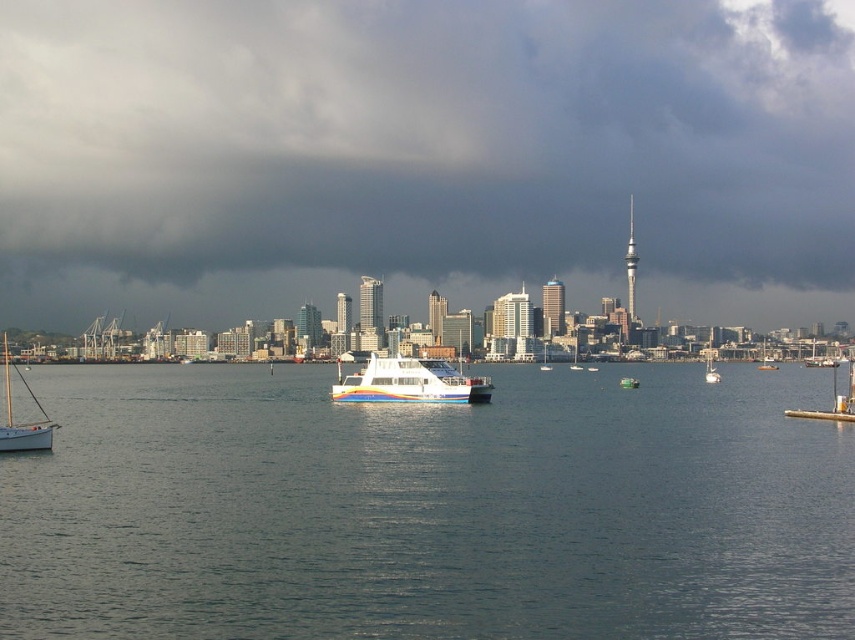
Question: Is white glossy boat at center wider than multicolored plastic boat at center?

Choices:
 (A) no
 (B) yes

Answer: (B)

Question: Can you confirm if rainbow painted ferry at center is positioned to the right of multicolored plastic boat at center?

Choices:
 (A) yes
 (B) no

Answer: (B)

Question: Which object is closer to the camera taking this photo?

Choices:
 (A) rainbow painted ferry at center
 (B) multicolored plastic boat at center

Answer: (A)

Question: Which object is positioned closest to the multicolored plastic boat at center?

Choices:
 (A) metallic silver boat at center
 (B) clear water at center
 (C) rainbow painted ferry at center

Answer: (A)

Question: Which of the following is the farthest from the observer?

Choices:
 (A) (759, 364)
 (B) (809, 417)
 (C) (28, 435)
 (D) (721, 72)

Answer: (D)

Question: Is metallic silver boat at center wider than white glossy boat at center?

Choices:
 (A) yes
 (B) no

Answer: (A)